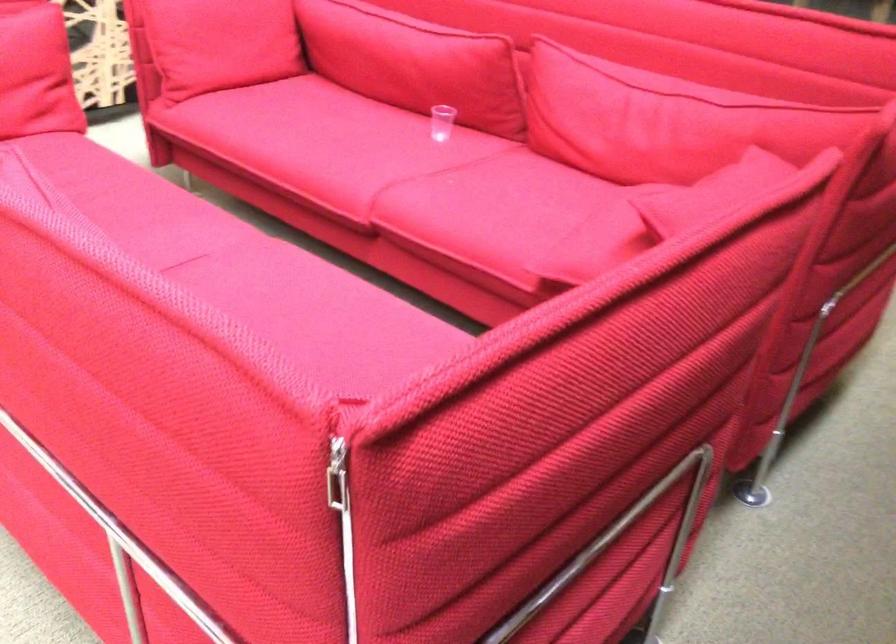
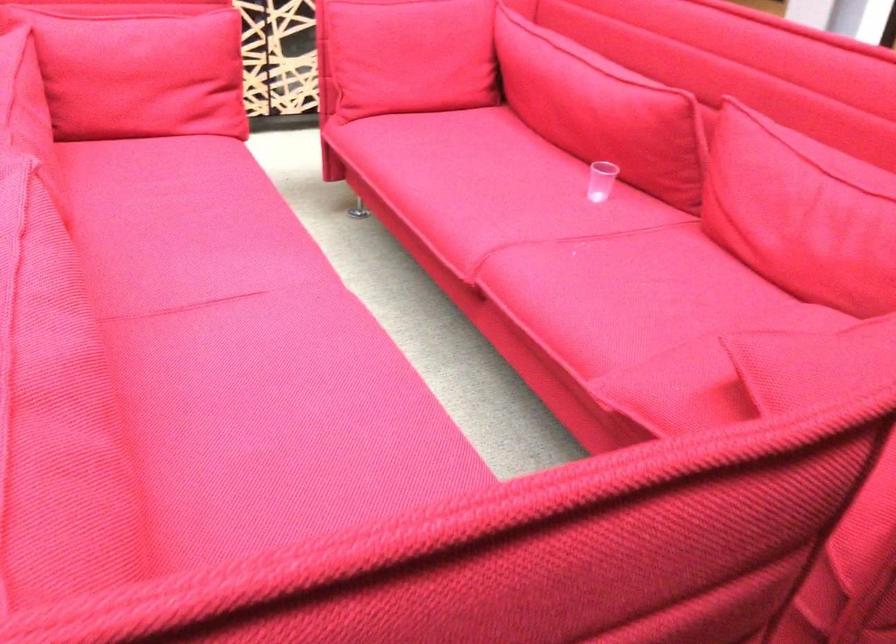
Where in the second image is the point corresponding to the point at 616,118 from the first image?

(800, 213)